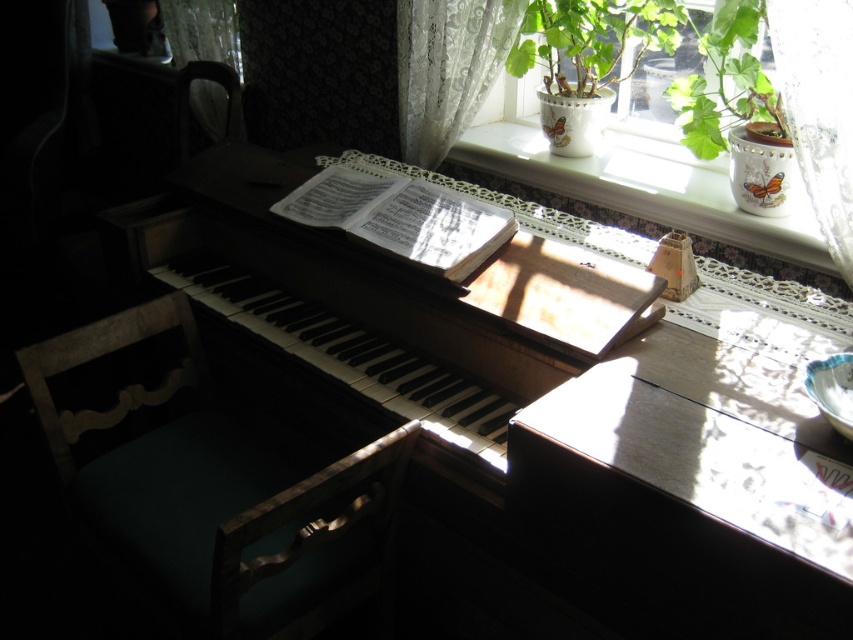
Question: Can you confirm if white lace at upper right is positioned to the left of green leafy plant at upper right?

Choices:
 (A) no
 (B) yes

Answer: (B)

Question: Does white lace at upper right appear under white lace curtain at upper right?

Choices:
 (A) yes
 (B) no

Answer: (A)

Question: Which point is closer to the camera?

Choices:
 (A) (695, 29)
 (B) (572, 170)

Answer: (A)

Question: Which of the following is the farthest from the observer?

Choices:
 (A) (422, 36)
 (B) (703, 48)

Answer: (A)

Question: Does white lace at upper right appear under green matte plant at upper right?

Choices:
 (A) yes
 (B) no

Answer: (A)

Question: Which object is positioned farthest from the white lace curtain at upper right?

Choices:
 (A) green fabric chair at lower left
 (B) white lace at upper right

Answer: (A)